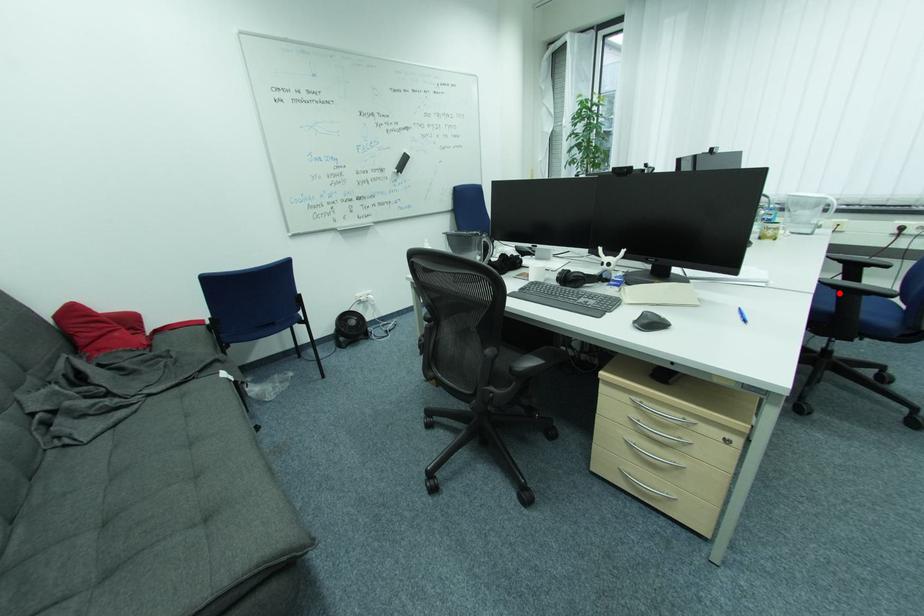
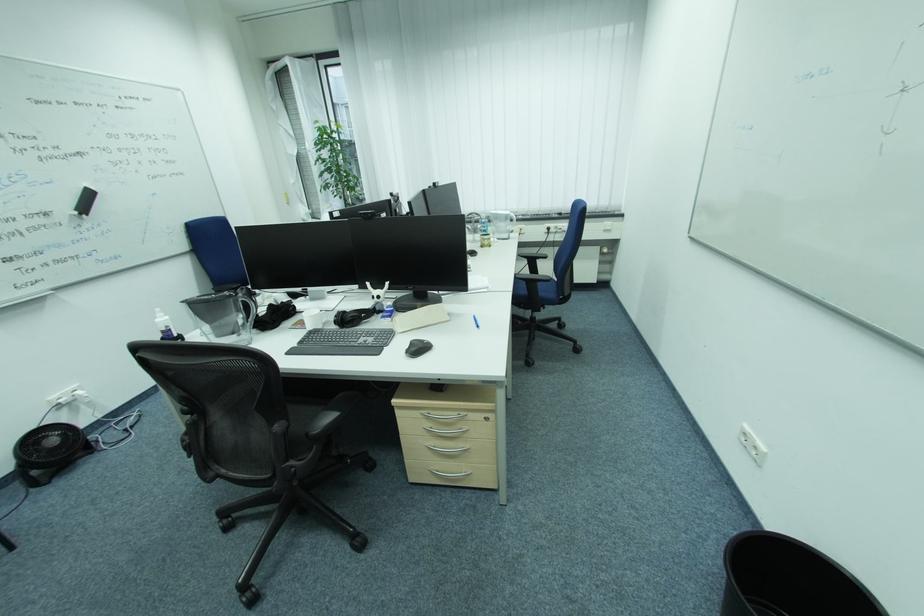
Question: I am providing you with two images of the same scene from different viewpoints. In image1, a red point is highlighted. Considering the same 3D point in image2, which of the following is correct?

Choices:
 (A) It is closer
 (B) It is farther

Answer: (B)